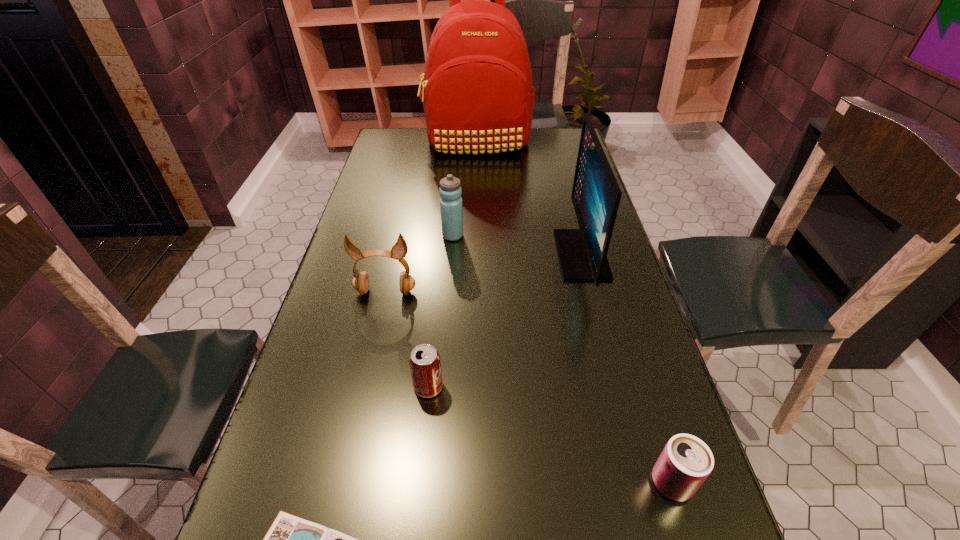
Identify the location of vacant space that satisfies the following two spatial constraints: 1. on the front-facing side of the soda can; 2. on the left side of the earphone. Image resolution: width=960 pixels, height=540 pixels. (365, 387).